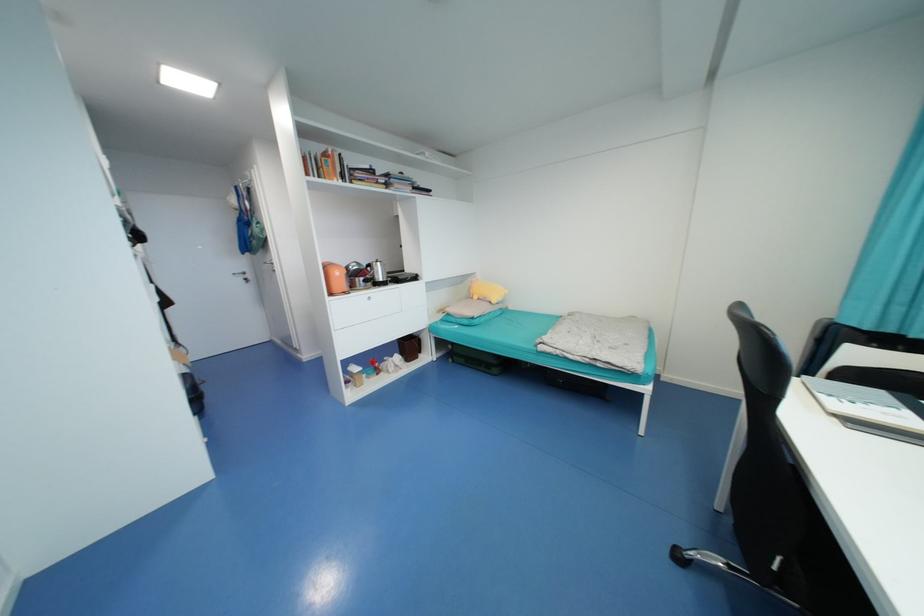
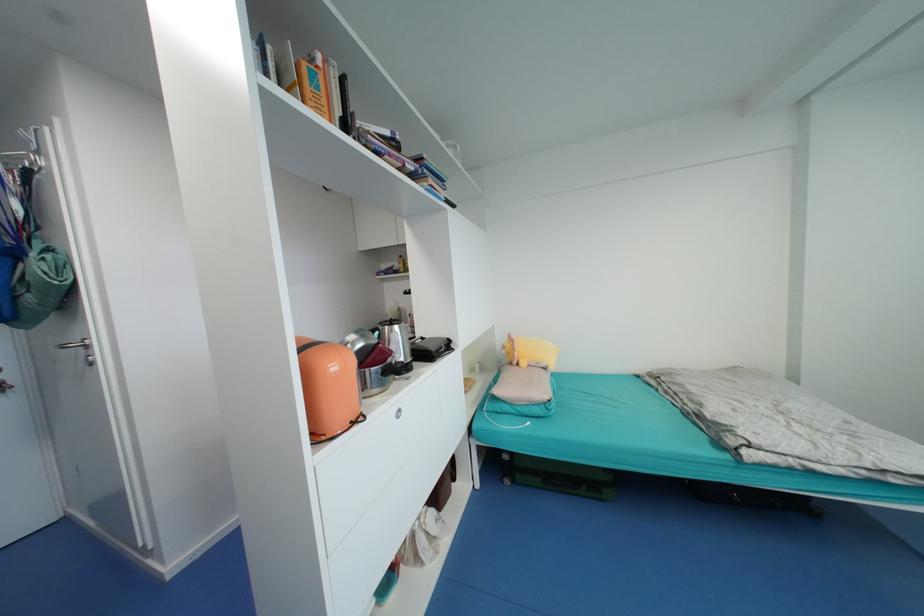
Where in the second image is the point corresponding to [383,264] from the first image?

(400, 328)